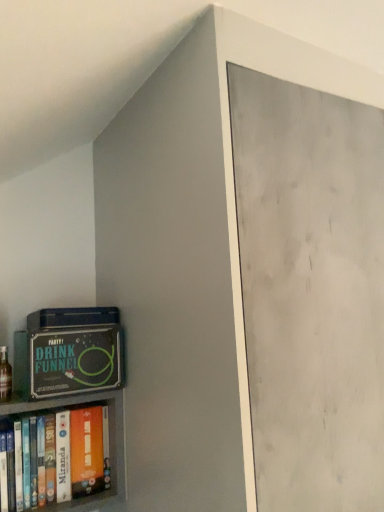
Question: Is translucent glass bottle at lower left positioned before orange matte book at lower left?

Choices:
 (A) no
 (B) yes

Answer: (A)

Question: Would you say translucent glass bottle at lower left contains orange matte book at lower left?

Choices:
 (A) yes
 (B) no

Answer: (B)

Question: From the image's perspective, is translucent glass bottle at lower left above orange matte book at lower left?

Choices:
 (A) no
 (B) yes

Answer: (B)

Question: From a real-world perspective, is translucent glass bottle at lower left physically below orange matte book at lower left?

Choices:
 (A) no
 (B) yes

Answer: (A)

Question: Is translucent glass bottle at lower left taller than orange matte book at lower left?

Choices:
 (A) yes
 (B) no

Answer: (B)

Question: From their relative heights in the image, would you say orange matte book at lower left is taller or shorter than translucent glass bottle at lower left?

Choices:
 (A) short
 (B) tall

Answer: (B)

Question: Is orange matte book at lower left inside or outside of translucent glass bottle at lower left?

Choices:
 (A) inside
 (B) outside

Answer: (B)

Question: Based on their positions, is orange matte book at lower left located to the left or right of translucent glass bottle at lower left?

Choices:
 (A) left
 (B) right

Answer: (B)

Question: From a real-world perspective, is orange matte book at lower left positioned above or below translucent glass bottle at lower left?

Choices:
 (A) below
 (B) above

Answer: (A)

Question: From the image's perspective, relative to translucent glass bottle at lower left, is green matte board game at lower left above or below?

Choices:
 (A) below
 (B) above

Answer: (B)

Question: In terms of size, does green matte board game at lower left appear bigger or smaller than translucent glass bottle at lower left?

Choices:
 (A) big
 (B) small

Answer: (A)

Question: Is green matte board game at lower left taller or shorter than translucent glass bottle at lower left?

Choices:
 (A) short
 (B) tall

Answer: (B)

Question: From a real-world perspective, relative to translucent glass bottle at lower left, is green matte board game at lower left vertically above or below?

Choices:
 (A) above
 (B) below

Answer: (A)

Question: Which is correct: green matte board game at lower left is inside orange matte book at lower left, or outside of it?

Choices:
 (A) inside
 (B) outside

Answer: (B)

Question: From the image's perspective, relative to orange matte book at lower left, is green matte board game at lower left above or below?

Choices:
 (A) above
 (B) below

Answer: (A)